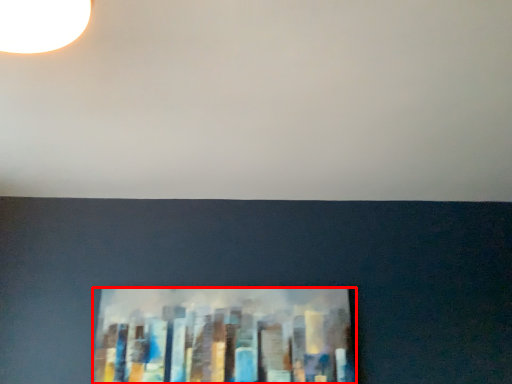
Question: From the image, what is the correct spatial relationship of picture frame (annotated by the red box) in relation to backdrop?

Choices:
 (A) right
 (B) left

Answer: (B)